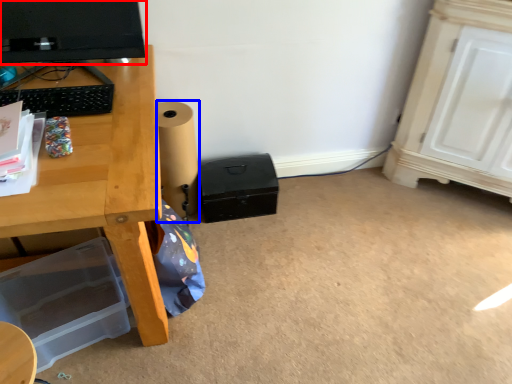
Question: Which point is further to the camera, computer monitor (highlighted by a red box) or speaker (highlighted by a blue box)?

Choices:
 (A) computer monitor
 (B) speaker

Answer: (B)